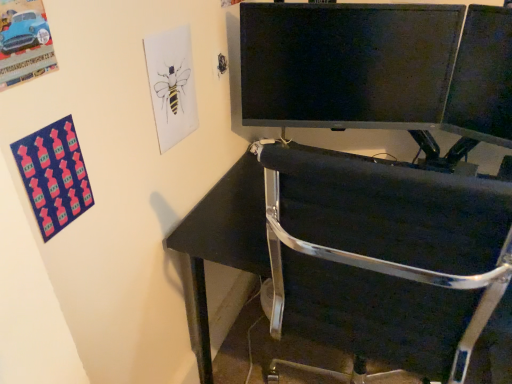
Question: Considering the relative sizes of black metal chair at lower right and black glossy monitor at upper center in the image provided, is black metal chair at lower right smaller than black glossy monitor at upper center?

Choices:
 (A) yes
 (B) no

Answer: (B)

Question: Is black metal chair at lower right bigger than black glossy monitor at upper center?

Choices:
 (A) yes
 (B) no

Answer: (A)

Question: Is black metal chair at lower right oriented towards black glossy monitor at upper center?

Choices:
 (A) no
 (B) yes

Answer: (A)

Question: Is black metal chair at lower right thinner than black glossy monitor at upper center?

Choices:
 (A) yes
 (B) no

Answer: (B)

Question: From the image's perspective, does black metal chair at lower right appear higher than black glossy monitor at upper center?

Choices:
 (A) no
 (B) yes

Answer: (A)

Question: Based on their sizes in the image, would you say black glossy monitor at upper center is bigger or smaller than black metal chair at lower right?

Choices:
 (A) small
 (B) big

Answer: (A)

Question: Is black glossy monitor at upper center taller or shorter than black metal chair at lower right?

Choices:
 (A) tall
 (B) short

Answer: (B)

Question: Is black glossy monitor at upper center to the left or to the right of black metal chair at lower right in the image?

Choices:
 (A) left
 (B) right

Answer: (A)

Question: Looking at their shapes, would you say black glossy monitor at upper center is wider or thinner than black metal chair at lower right?

Choices:
 (A) wide
 (B) thin

Answer: (B)

Question: From a real-world perspective, relative to black metal chair at lower right, is matte black monitor at upper right vertically above or below?

Choices:
 (A) above
 (B) below

Answer: (A)

Question: Based on their sizes in the image, would you say matte black monitor at upper right is bigger or smaller than black metal chair at lower right?

Choices:
 (A) big
 (B) small

Answer: (B)

Question: Is matte black monitor at upper right wider or thinner than black metal chair at lower right?

Choices:
 (A) thin
 (B) wide

Answer: (A)

Question: Would you say matte black monitor at upper right is inside or outside black metal chair at lower right?

Choices:
 (A) inside
 (B) outside

Answer: (B)

Question: Is black glossy monitor at upper center wider or thinner than matte black monitor at upper right?

Choices:
 (A) wide
 (B) thin

Answer: (B)

Question: Considering their positions, is black glossy monitor at upper center located in front of or behind matte black monitor at upper right?

Choices:
 (A) front
 (B) behind

Answer: (B)